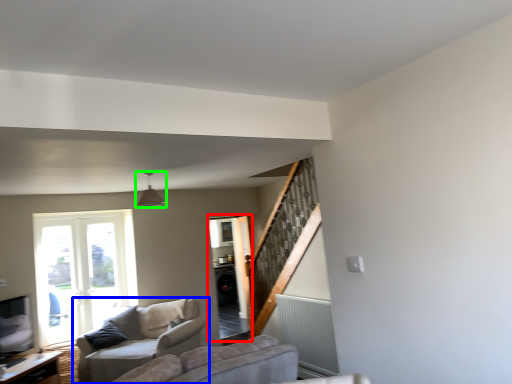
Question: Which object is the closest to the screen door (highlighted by a red box)? Choose among these: studio couch (highlighted by a blue box) or light fixture (highlighted by a green box).

Choices:
 (A) studio couch
 (B) light fixture

Answer: (A)